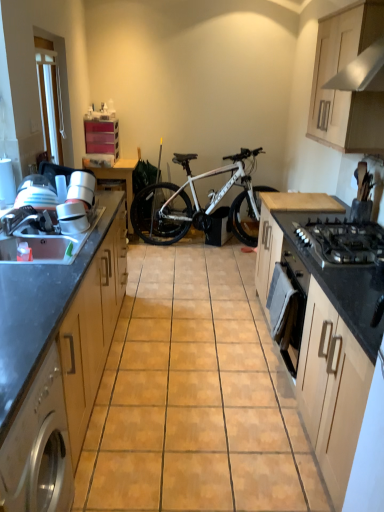
What are the coordinates of `free space in front of white matte bicycle at center` in the screenshot? It's located at (207, 269).